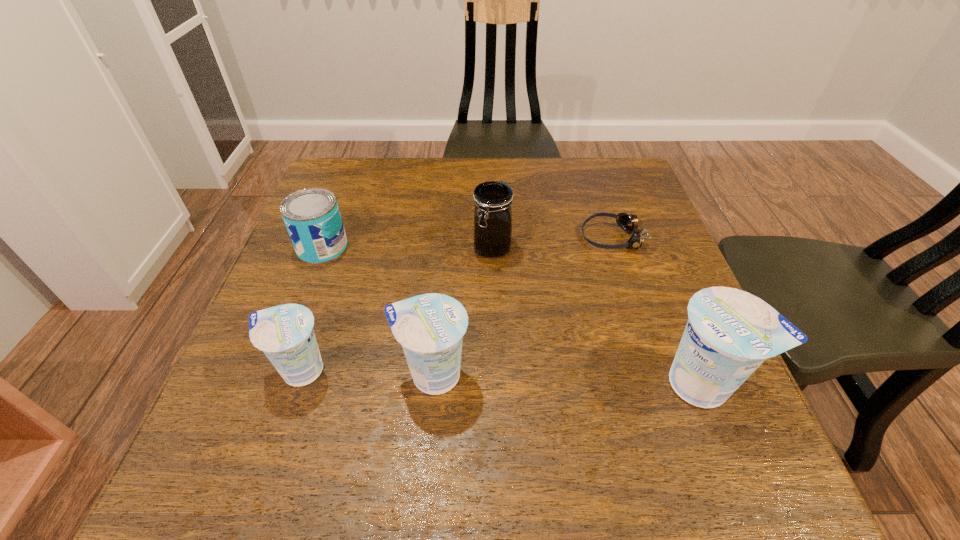
Find the location of `the leftmost yogurt`. the leftmost yogurt is located at coordinates (285, 333).

Identify the location of the third object from left to right. The height and width of the screenshot is (540, 960). (430, 327).

Identify the location of the second tallest yogurt. The image size is (960, 540). (430, 327).

Identify the location of the rightmost yogurt. The width and height of the screenshot is (960, 540). pos(730,333).

The image size is (960, 540). I want to click on goggles, so click(x=629, y=223).

This screenshot has height=540, width=960. Find the location of `can`. can is located at coordinates (312, 217).

Image resolution: width=960 pixels, height=540 pixels. I want to click on jar, so click(492, 200).

Image resolution: width=960 pixels, height=540 pixels. In order to click on free space located 0.080m on the right of the leftmost yogurt in this screenshot , I will do `click(375, 370)`.

The width and height of the screenshot is (960, 540). I want to click on free space located on the right of the second yogurt from left to right, so click(x=592, y=375).

Where is `vacant region located on the left of the rightmost yogurt`? vacant region located on the left of the rightmost yogurt is located at coordinates (499, 384).